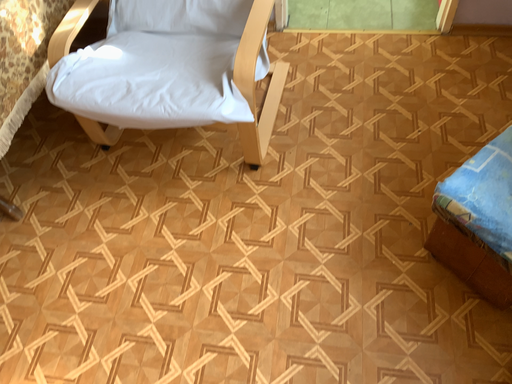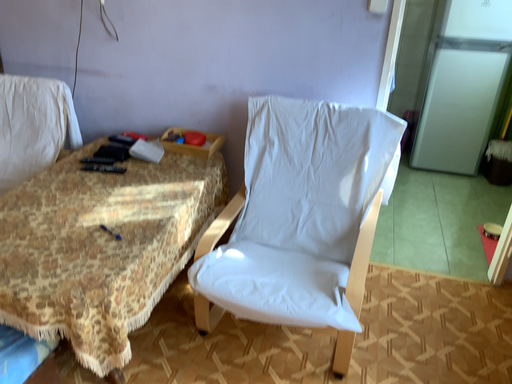
Question: Which way did the camera rotate in the video?

Choices:
 (A) rotated upward
 (B) rotated downward

Answer: (A)